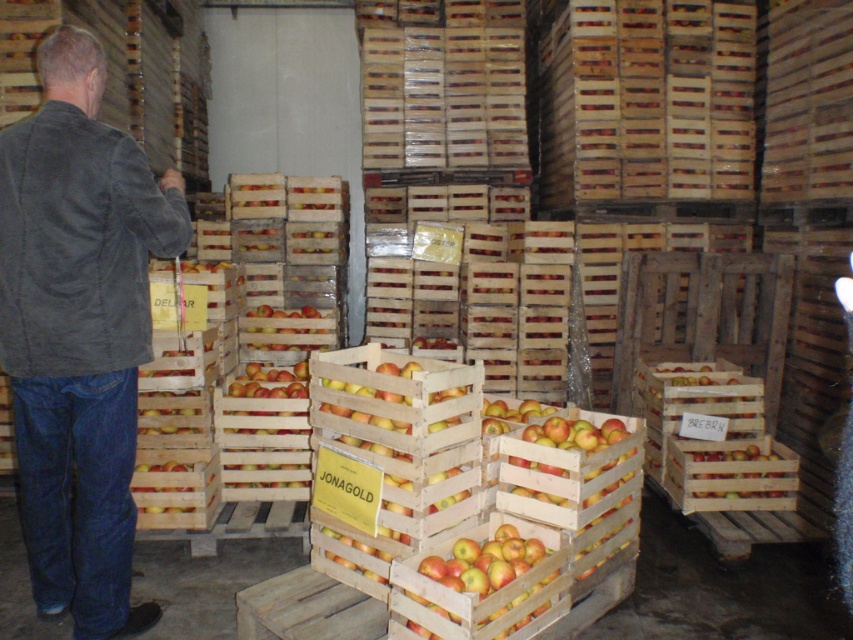
This screenshot has height=640, width=853. Identify the location of dark gray suede jacket at left. (78, 244).

Between point (68, 148) and point (199, 492), which one is positioned in front?

Point (68, 148) is more forward.

Describe the element at coordinates (78, 244) in the screenshot. I see `dark gray suede jacket at left` at that location.

The height and width of the screenshot is (640, 853). In order to click on dark gray suede jacket at left in this screenshot , I will do `click(78, 244)`.

Can you confirm if dark gray corduroy jacket at left is positioned to the right of yellow matte apple at center?

No, dark gray corduroy jacket at left is not to the right of yellow matte apple at center.

Based on the photo, who is more forward, [122,420] or [165,502]?

Point [122,420] is more forward.

What do you see at coordinates (79, 332) in the screenshot? The width and height of the screenshot is (853, 640). I see `dark gray corduroy jacket at left` at bounding box center [79, 332].

Image resolution: width=853 pixels, height=640 pixels. In order to click on dark gray corduroy jacket at left in this screenshot , I will do `click(79, 332)`.

Is point (76, 64) more distant than point (22, 355)?

No, it is in front of (22, 355).

Is dark gray corduroy jacket at left bigger than dark gray suede jacket at left?

Yes, dark gray corduroy jacket at left is bigger than dark gray suede jacket at left.

Between point (140, 230) and point (78, 204), which one is positioned in front?

Point (78, 204) is more forward.

The width and height of the screenshot is (853, 640). I want to click on dark gray corduroy jacket at left, so click(x=79, y=332).